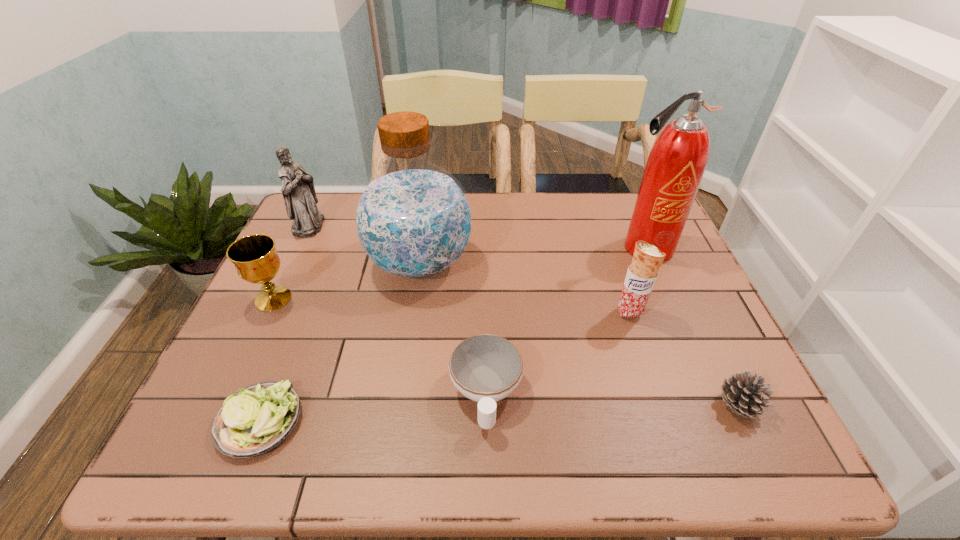
Where is `lettuce present at the near edge`? The height and width of the screenshot is (540, 960). lettuce present at the near edge is located at coordinates (258, 418).

Where is `figurine at the left edge`? figurine at the left edge is located at coordinates (298, 190).

Locate an element on the screen. The image size is (960, 540). chalice that is at the left edge is located at coordinates (256, 261).

You are a GUI agent. You are given a task and a screenshot of the screen. Output one action in this format:
    pyautogui.click(x=<x>, y=<y>)
    Task: Click on the lettuce situated at the left edge
    
    Given the screenshot: What is the action you would take?
    pyautogui.click(x=258, y=418)

Where is `fire extinguisher that is at the right edge`? Image resolution: width=960 pixels, height=540 pixels. fire extinguisher that is at the right edge is located at coordinates (676, 164).

This screenshot has width=960, height=540. I want to click on pinecone located in the right edge section of the desktop, so click(743, 392).

I want to click on object that is at the far left corner, so click(298, 190).

Locate an element on the screen. This screenshot has height=540, width=960. object at the near left corner is located at coordinates (258, 418).

The image size is (960, 540). I want to click on object that is at the far right corner, so click(x=676, y=164).

Find the location of a particular element. This screenshot has width=960, height=540. object situated at the near right corner is located at coordinates (743, 392).